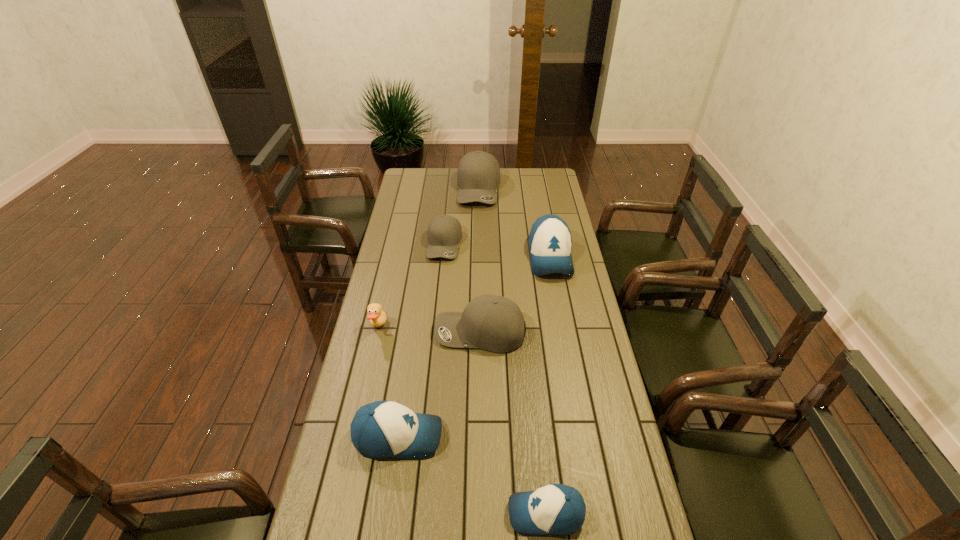
Locate an element on the screen. This screenshot has height=540, width=960. vacant point located between the second farthest gray baseball cap and the second smallest blue baseball cap is located at coordinates (421, 340).

You are a GUI agent. You are given a task and a screenshot of the screen. Output one action in this format:
    pyautogui.click(x=<x>, y=<y>)
    Task: Click on the free space between the biggest blue baseball cap and the duck
    
    Given the screenshot: What is the action you would take?
    pyautogui.click(x=464, y=292)

In order to click on vacant space that is in between the leftmost blue baseball cap and the smallest gray baseball cap in this screenshot , I will do `click(421, 340)`.

Image resolution: width=960 pixels, height=540 pixels. Identify the location of empty space between the shortest object and the duck. (462, 420).

Locate an element on the screen. object that stands as the sixth closest to the leftmost blue baseball cap is located at coordinates (478, 175).

Where is `the sixth closest object to the fourth farthest baseball cap`? This screenshot has height=540, width=960. the sixth closest object to the fourth farthest baseball cap is located at coordinates (478, 175).

Find the location of a particular element. This screenshot has height=540, width=960. baseball cap that is the second closest to the nearest baseball cap is located at coordinates (493, 323).

Identify which baseball cap is the closest to the second nearest gray baseball cap. Please provide its 2D coordinates. Your answer should be formatted as a tuple, i.e. [(x, y)], where the tuple contains the x and y coordinates of a point satisfying the conditions above.

[(478, 175)]

Select which gray baseball cap appears as the second closest to the tan duck. Please provide its 2D coordinates. Your answer should be formatted as a tuple, i.e. [(x, y)], where the tuple contains the x and y coordinates of a point satisfying the conditions above.

[(444, 232)]

Locate which gray baseball cap is the second closest to the second farthest blue baseball cap. Please provide its 2D coordinates. Your answer should be formatted as a tuple, i.e. [(x, y)], where the tuple contains the x and y coordinates of a point satisfying the conditions above.

[(444, 232)]